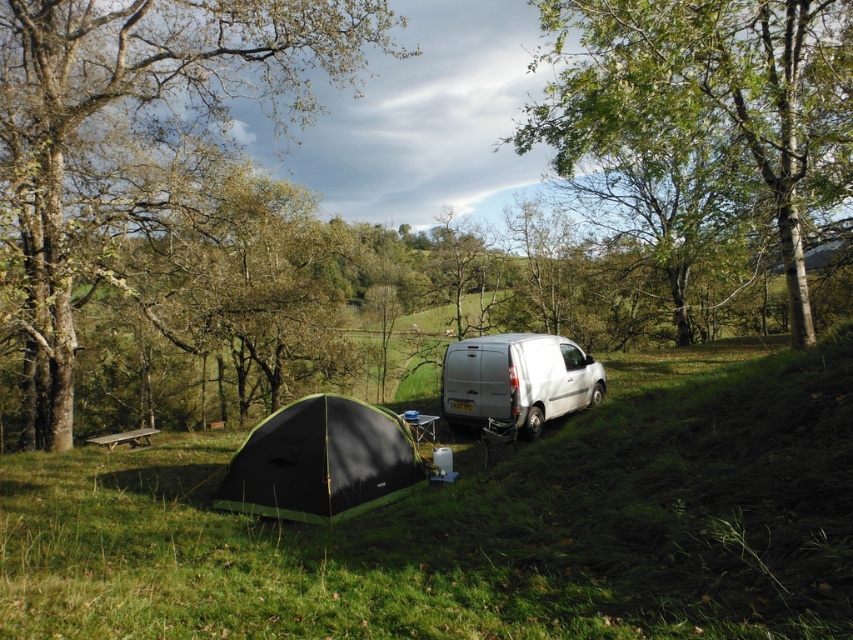
You are a hiker who needs to set up a 10 meter long tent. You have two options for placement between the green grassy at lower left and the brown rough tree at left. Can you place the tent between them without overlapping either object?

The distance between green grassy at lower left and brown rough tree at left is 8.90 meters. Since the tent is 10 meters long, which is longer than the available space, you cannot place the tent between them without overlapping either object.